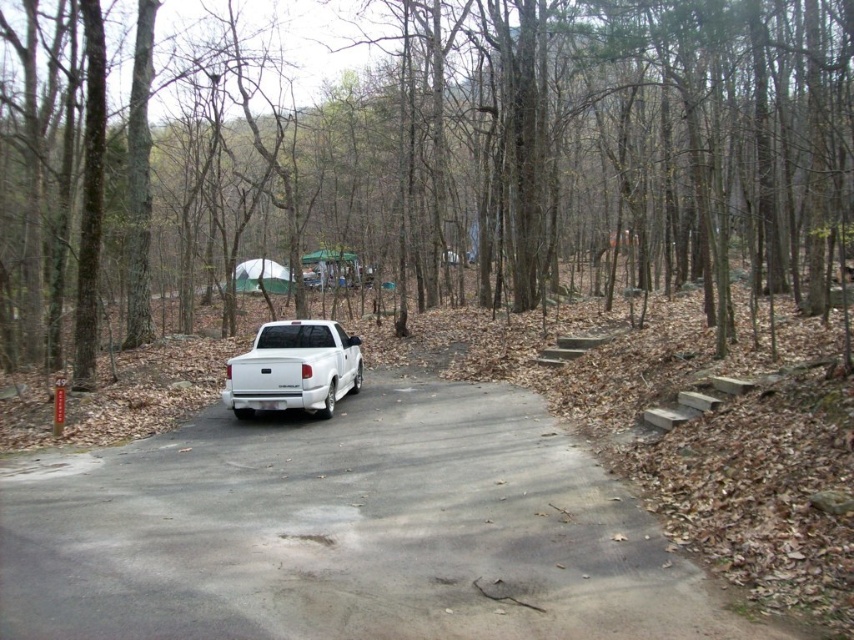
Does brown rough tree at center have a smaller size compared to white asphalt road at center?

Actually, brown rough tree at center might be larger than white asphalt road at center.

Is brown rough tree at center behind white asphalt road at center?

Yes, it is behind white asphalt road at center.

Is point (504, 225) positioned after point (390, 577)?

Yes, it is.

Where is `brown rough tree at center`? This screenshot has height=640, width=854. brown rough tree at center is located at coordinates (591, 141).

Does brown rough tree at center appear over white glossy truck at center?

Indeed, brown rough tree at center is positioned over white glossy truck at center.

From the picture: Does brown rough tree at center come behind white glossy truck at center?

No, brown rough tree at center is in front of white glossy truck at center.

Locate an element on the screen. The height and width of the screenshot is (640, 854). brown rough tree at center is located at coordinates (591, 141).

Identify the location of brown rough tree at center. (591, 141).

Consider the image. Between white asphalt road at center and white glossy truck at center, which one has more height?

white glossy truck at center

Between point (336, 524) and point (254, 397), which one is positioned in front?

Point (336, 524) is in front.

Identify the location of white asphalt road at center. This screenshot has height=640, width=854. (347, 531).